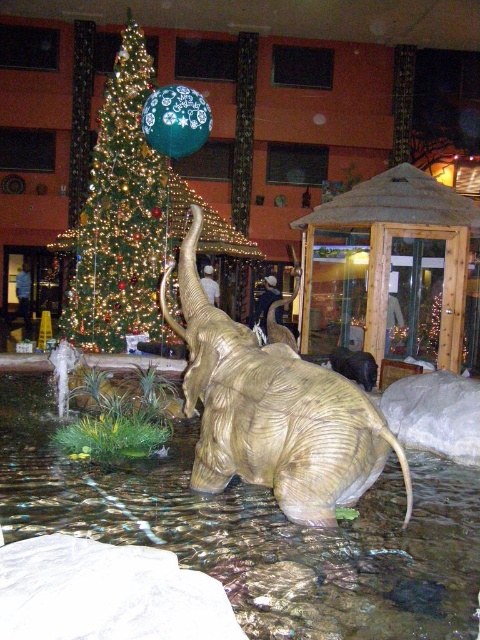
Question: Which of the following is the farthest from the observer?

Choices:
 (A) (326, 448)
 (B) (214, 211)

Answer: (B)

Question: Can you confirm if gold metallic elephant at center is positioned below green shiny christmas tree at left?

Choices:
 (A) no
 (B) yes

Answer: (B)

Question: Can you confirm if gold metallic elephant at center is bigger than green shiny christmas tree at left?

Choices:
 (A) yes
 (B) no

Answer: (B)

Question: Which point appears farthest from the camera in this image?

Choices:
 (A) (132, 304)
 (B) (311, 445)

Answer: (A)

Question: Does gold metallic elephant at center appear over green shiny christmas tree at left?

Choices:
 (A) yes
 (B) no

Answer: (B)